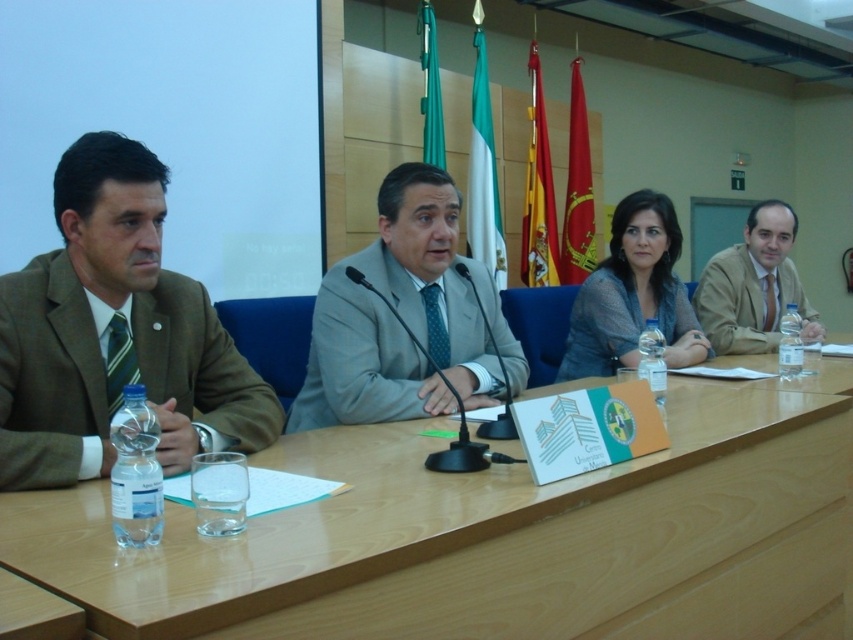
Based on the photo, between brown woolen suit at left and gray textured sweater at center, which one is positioned higher?

gray textured sweater at center is higher up.

Does brown woolen suit at left have a larger size compared to gray textured sweater at center?

Incorrect, brown woolen suit at left is not larger than gray textured sweater at center.

Does point (86, 300) come in front of point (682, 304)?

Yes, point (86, 300) is in front of point (682, 304).

Find the location of a particular element. Image resolution: width=853 pixels, height=640 pixels. brown woolen suit at left is located at coordinates (49, 378).

Does light gray fabric suit at center come in front of gray textured sweater at center?

That is True.

Does point (393, 339) come behind point (596, 346)?

No, (393, 339) is in front of (596, 346).

Where is `light gray fabric suit at center`? This screenshot has height=640, width=853. light gray fabric suit at center is located at coordinates (364, 348).

Does brown woolen suit at left have a greater height compared to light brown fabric suit at right?

No, brown woolen suit at left is not taller than light brown fabric suit at right.

Consider the image. Is brown woolen suit at left wider than light brown fabric suit at right?

No.

Who is more distant from viewer, (x=178, y=376) or (x=730, y=260)?

The point (x=730, y=260) is more distant.

Locate an element on the screen. The height and width of the screenshot is (640, 853). brown woolen suit at left is located at coordinates (49, 378).